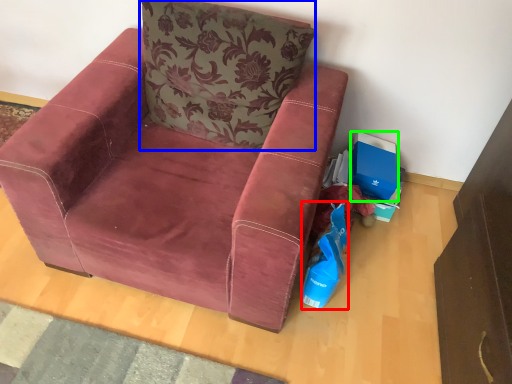
Question: Based on their relative distances, which object is farther from shopping bag (highlighted by a red box)? Choose from pillow (highlighted by a blue box) and storage box (highlighted by a green box).

Choices:
 (A) pillow
 (B) storage box

Answer: (A)